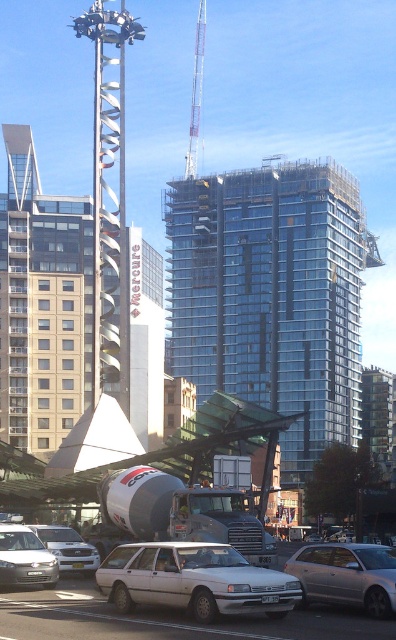
Question: Does silver metallic sedan at lower left have a smaller size compared to white matte sedan at lower left?

Choices:
 (A) yes
 (B) no

Answer: (A)

Question: Estimate the real-world distances between objects in this image. Which object is closer to the white matte sedan at lower left?

Choices:
 (A) silver metallic sedan at lower left
 (B) transparent glass building at center
 (C) white matte wagon at center
 (D) silver metallic sedan at center

Answer: (A)

Question: Estimate the real-world distances between objects in this image. Which object is closer to the white matte wagon at center?

Choices:
 (A) silver metallic sedan at lower left
 (B) silver metallic sedan at center
 (C) metallic gray crane at upper center
 (D) white matte sedan at lower left

Answer: (B)

Question: Is silver metallic sedan at center positioned behind white matte sedan at lower left?

Choices:
 (A) yes
 (B) no

Answer: (B)

Question: In this image, where is silver metallic sedan at lower left located relative to metallic gray crane at upper center?

Choices:
 (A) left
 (B) right

Answer: (B)

Question: Among these points, which one is nearest to the camera?

Choices:
 (A) (340, 320)
 (B) (13, 538)
 (C) (146, 589)

Answer: (C)